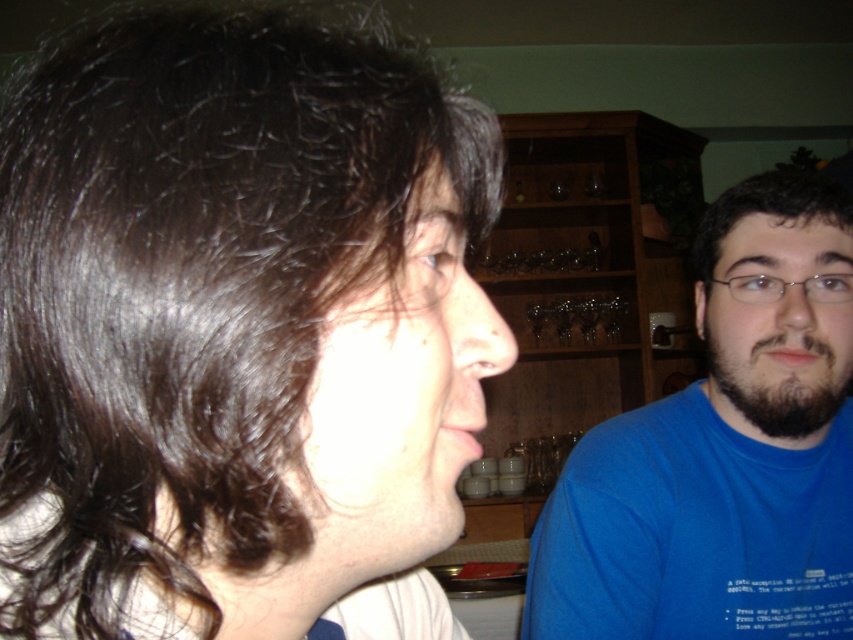
You are a photographer trying to capture a portrait of both the dark brown hair at upper left and the dark brown beard at right in the same frame. Your camera has a maximum focus range of 20 inches. Can both subjects be in focus simultaneously?

The distance between dark brown hair at upper left and dark brown beard at right is 20.35 inches, which exceeds the camera maximum focus range of 20 inches. Therefore, both subjects cannot be in focus simultaneously.